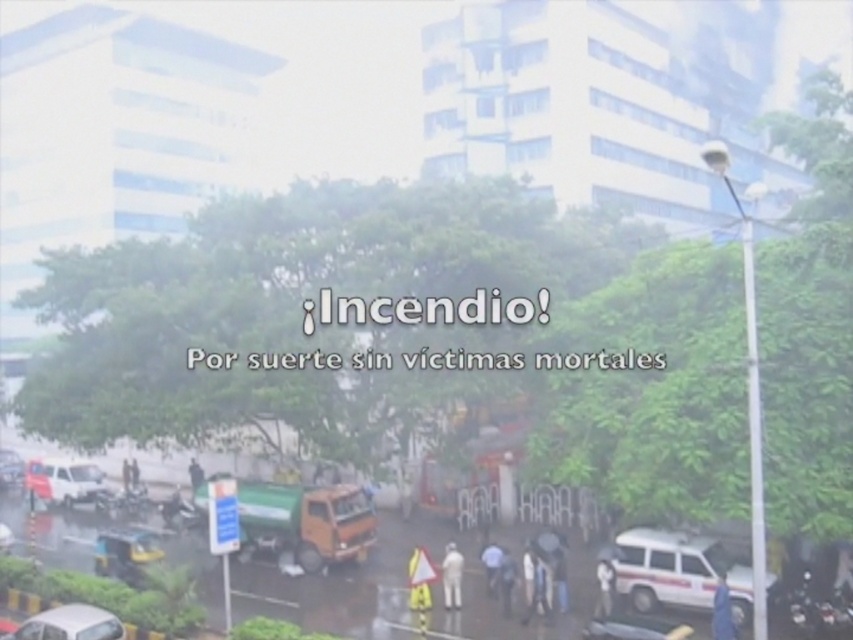
You are a city planner analyzing traffic flow in this area. Considering the orange matte truck at center and the white matte person at lower right, which object takes up more horizontal space in the image?

The orange matte truck at center has a greater width than the white matte person at lower right, so it occupies more horizontal space in the image.

Looking at this image, you are a pedestrian standing on the sidewalk and see the white matte van at lower left and the dark blue shirt at center. Which object is closer to your left side?

The white matte van at lower left is closer to your left side because it is positioned to the left of the dark blue shirt at center.